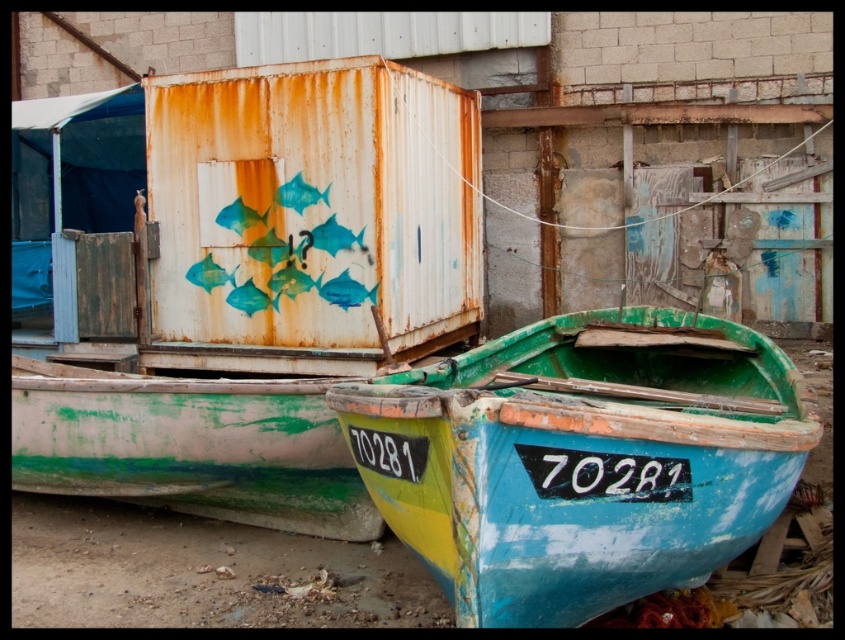
Is point (504, 602) farther from camera compared to point (287, 161)?

No.

Does green painted wood boat at center have a lesser height compared to rusty metal shipping container at upper center?

Yes, green painted wood boat at center is shorter than rusty metal shipping container at upper center.

Describe the element at coordinates (582, 460) in the screenshot. Image resolution: width=845 pixels, height=640 pixels. I see `green painted wood boat at center` at that location.

Locate an element on the screen. The width and height of the screenshot is (845, 640). green painted wood boat at center is located at coordinates (582, 460).